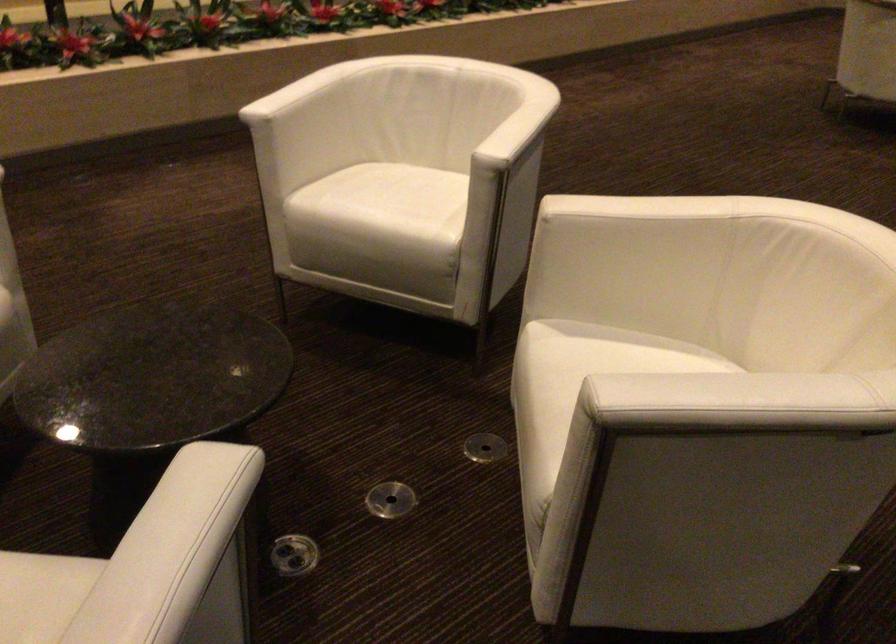
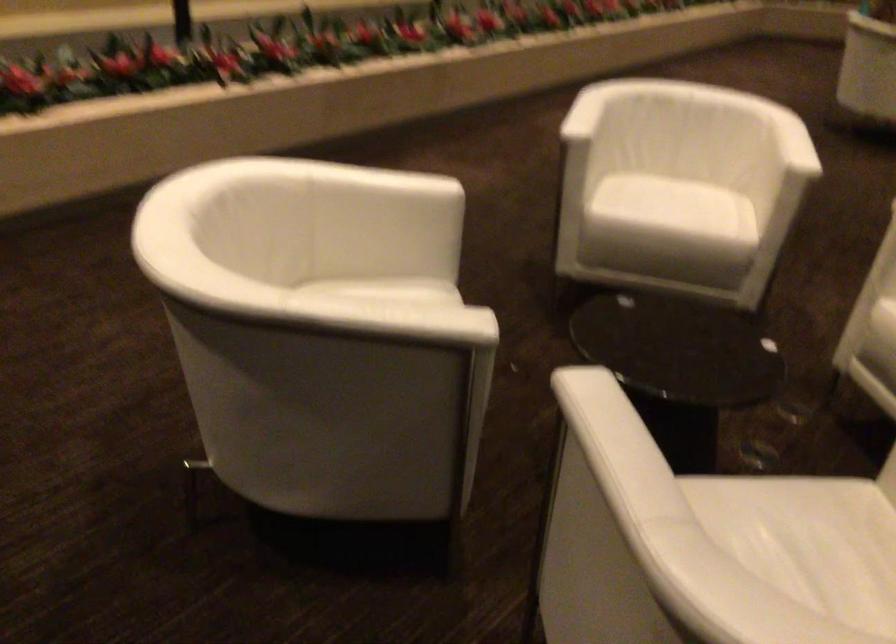
Question: Which direction would the cameraman need to move to produce the second image? Reply with the corresponding letter.

Choices:
 (A) Left
 (B) Right
 (C) Forward
 (D) Backward

Answer: (A)